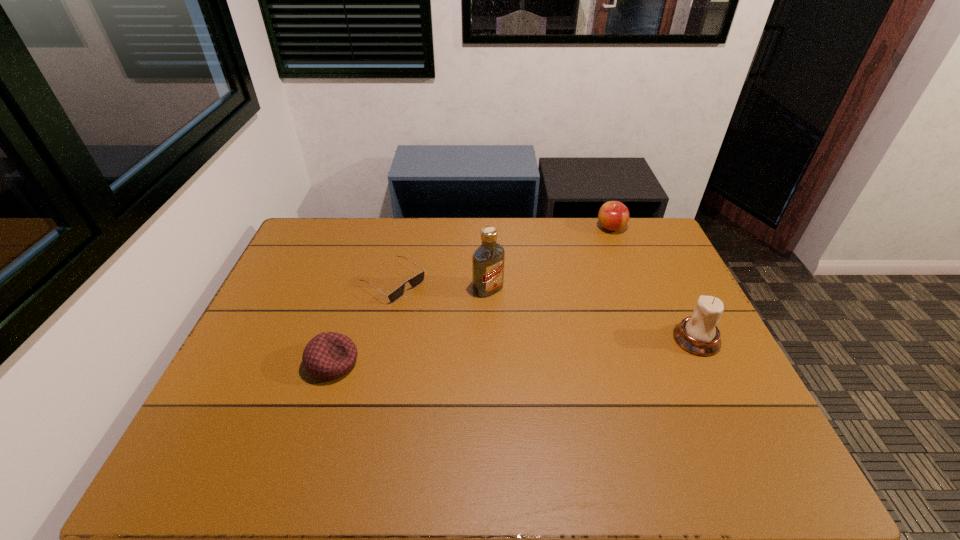
Where is `the fourth tallest object`? The width and height of the screenshot is (960, 540). the fourth tallest object is located at coordinates (329, 355).

Locate an element on the screen. candle holder is located at coordinates (698, 334).

At what (x,y) coordinates should I click in order to perform the action: click on sunglasses. Please return your answer as a coordinate pair (x, y). Looking at the image, I should click on (418, 279).

Locate an element on the screen. The height and width of the screenshot is (540, 960). the farthest object is located at coordinates (613, 215).

Locate an element on the screen. The height and width of the screenshot is (540, 960). the third shortest object is located at coordinates (613, 215).

Find the location of a particular element. the third object from right to left is located at coordinates (488, 259).

At what (x,y) coordinates should I click in order to perform the action: click on vodka. Please return your answer as a coordinate pair (x, y). The width and height of the screenshot is (960, 540). Looking at the image, I should click on (488, 259).

Where is `free location located on the back of the fourth tallest object`? The height and width of the screenshot is (540, 960). free location located on the back of the fourth tallest object is located at coordinates (362, 269).

Image resolution: width=960 pixels, height=540 pixels. I want to click on free region located 0.190m on the left of the candle holder, so click(x=606, y=339).

At what (x,y) coordinates should I click in order to perform the action: click on free space located on the front-facing side of the sunglasses. Please return your answer as a coordinate pair (x, y). Looking at the image, I should click on (444, 315).